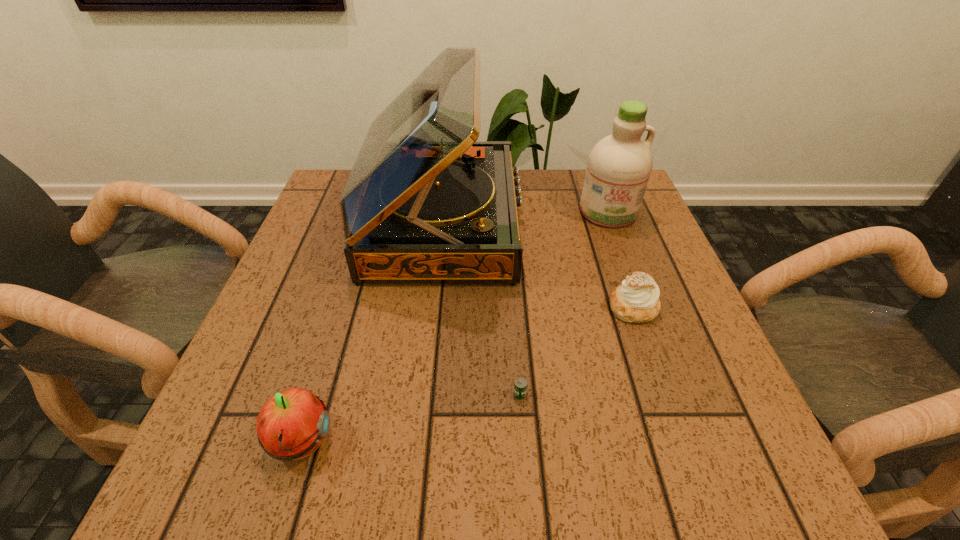
You are a GUI agent. You are given a task and a screenshot of the screen. Output one action in this format:
    pyautogui.click(x=<x>, y=<y>)
    Task: Click on the record player
    The width and height of the screenshot is (960, 540).
    Given the screenshot: What is the action you would take?
    pyautogui.click(x=425, y=202)

Where is `cleansing agent`? This screenshot has width=960, height=540. cleansing agent is located at coordinates (619, 166).

This screenshot has width=960, height=540. Find the location of `apple`. apple is located at coordinates (291, 425).

Locate an element on the screen. The width and height of the screenshot is (960, 540). pastry is located at coordinates (636, 300).

Identify the location of the third farthest object. The image size is (960, 540). (636, 300).

Locate an element on the screen. The width and height of the screenshot is (960, 540). the shortest object is located at coordinates (520, 386).

The image size is (960, 540). I want to click on free space located on the front-facing side of the record player, so click(x=553, y=222).

At what (x,y) coordinates should I click in order to perform the action: click on free spot located 0.190m on the front label of the cleansing agent. Please return your answer as a coordinate pair (x, y). The image size is (960, 540). Looking at the image, I should click on tap(635, 284).

I want to click on vacant position located 0.050m on the left of the third tallest object, so click(x=235, y=442).

At what (x,y) coordinates should I click in order to perform the action: click on vacant space located on the front of the third nearest object. Please return your answer as a coordinate pair (x, y). Looking at the image, I should click on (693, 479).